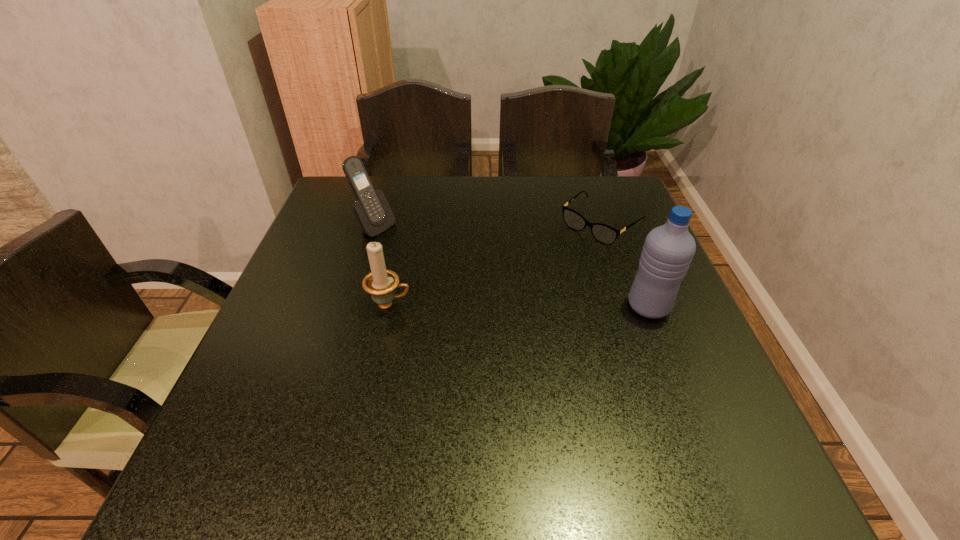
You are a GUI agent. You are given a task and a screenshot of the screen. Output one action in this format:
    pyautogui.click(x=<x>, y=<y>)
    Task: Click on the unoccupied area between the cellular telephone and the shortest object
    This screenshot has width=960, height=540.
    Given the screenshot: What is the action you would take?
    pyautogui.click(x=488, y=226)

Identify the location of vacant area that lies between the tallest object and the cellular telephone. 512,267.

Identify which object is the second closest to the candle_holder. Please provide its 2D coordinates. Your answer should be formatted as a tuple, i.e. [(x, y)], where the tuple contains the x and y coordinates of a point satisfying the conditions above.

[(603, 233)]

Identify which object is the nearest to the candle_holder. Please provide its 2D coordinates. Your answer should be formatted as a tuple, i.e. [(x, y)], where the tuple contains the x and y coordinates of a point satisfying the conditions above.

[(372, 211)]

Find the location of `vacant area that satisfies the following two spatial constraints: 1. on the front side of the candle_holder; 2. on the handle side of the cellular telephone`. vacant area that satisfies the following two spatial constraints: 1. on the front side of the candle_holder; 2. on the handle side of the cellular telephone is located at coordinates (350, 305).

Image resolution: width=960 pixels, height=540 pixels. Find the location of `vacant space that satisfies the following two spatial constraints: 1. on the back side of the cellular telephone; 2. on the left side of the shortest object`. vacant space that satisfies the following two spatial constraints: 1. on the back side of the cellular telephone; 2. on the left side of the shortest object is located at coordinates (375, 224).

Image resolution: width=960 pixels, height=540 pixels. I want to click on free spot that satisfies the following two spatial constraints: 1. on the front side of the spectacles; 2. on the right side of the water bottle, so click(630, 306).